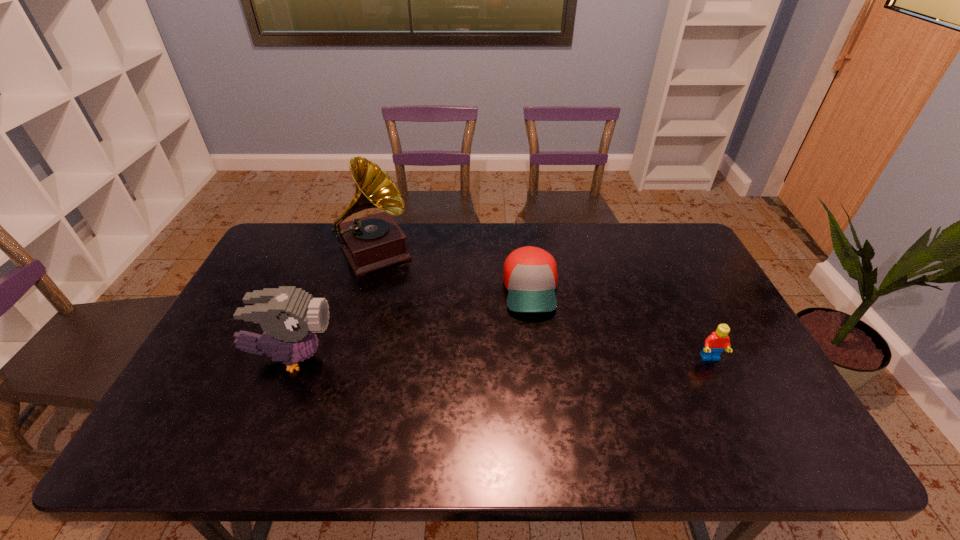
Identify the location of the second tallest object. (289, 316).

Find the location of `Lego`. Lego is located at coordinates (715, 343).

This screenshot has width=960, height=540. In order to click on phonograph record in this screenshot , I will do `click(372, 242)`.

This screenshot has height=540, width=960. Find the location of `the third object from left to right`. the third object from left to right is located at coordinates (530, 275).

At what (x,y) coordinates should I click in order to perform the action: click on vacant position located at the beak of the third shortest object. Please return your answer as a coordinate pair (x, y). The width and height of the screenshot is (960, 540). Looking at the image, I should click on (368, 359).

You are a GUI agent. You are given a task and a screenshot of the screen. Output one action in this format:
    pyautogui.click(x=<x>, y=<y>)
    Task: Click on the free region located 0.120m on the face of the rightmost object
    This screenshot has width=960, height=540.
    Given the screenshot: What is the action you would take?
    733,404

This screenshot has width=960, height=540. I want to click on free space located from the horn of the phonograph record, so click(x=400, y=298).

Locate an element on the screen. Image resolution: width=960 pixels, height=540 pixels. free region located from the horn of the phonograph record is located at coordinates (403, 302).

I want to click on vacant area situated 0.100m from the horn of the phonograph record, so click(x=399, y=296).

Where is `vacant space located at the brim of the second object from right to left`? vacant space located at the brim of the second object from right to left is located at coordinates (540, 366).